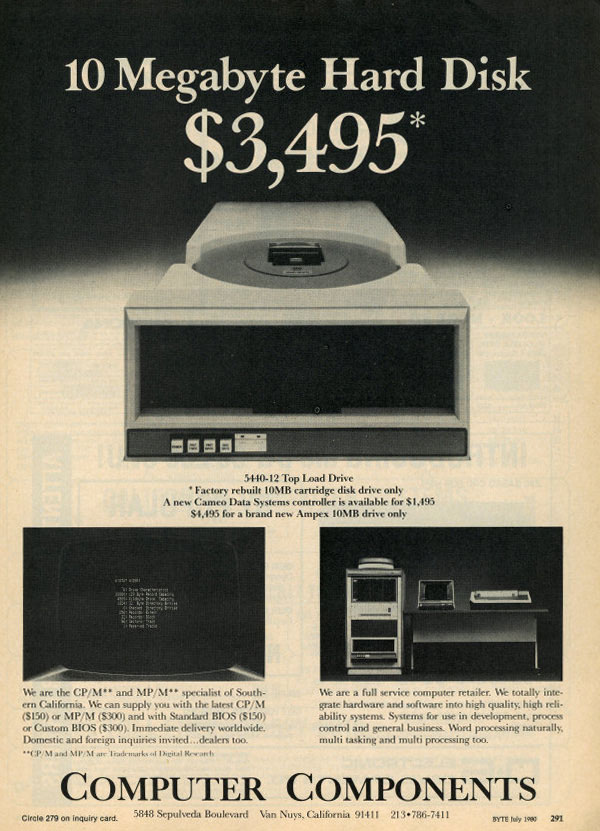
The height and width of the screenshot is (831, 600). In order to click on monitor in this screenshot , I will do `click(194, 622)`.